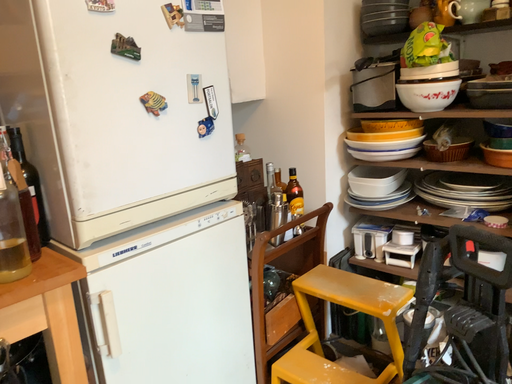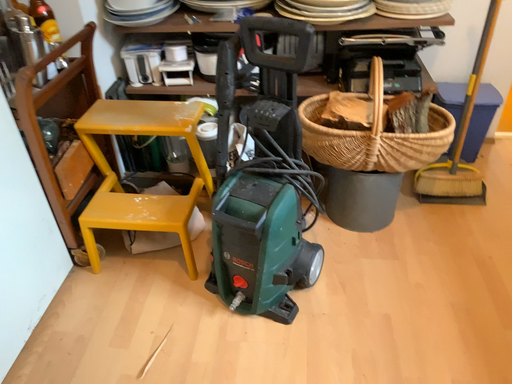
Question: How did the camera likely rotate when shooting the video?

Choices:
 (A) rotated left
 (B) rotated right

Answer: (B)